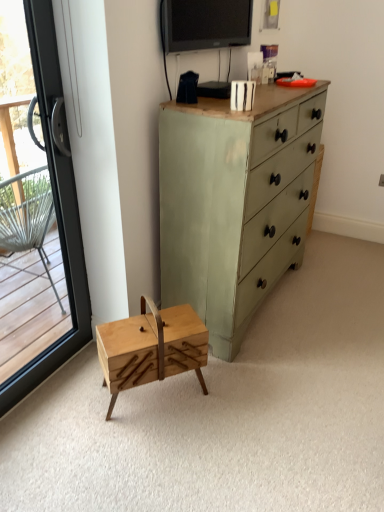
What are the coordinates of `vacant area that lies to the right of green painted wood chest of drawers at center` in the screenshot? It's located at (331, 294).